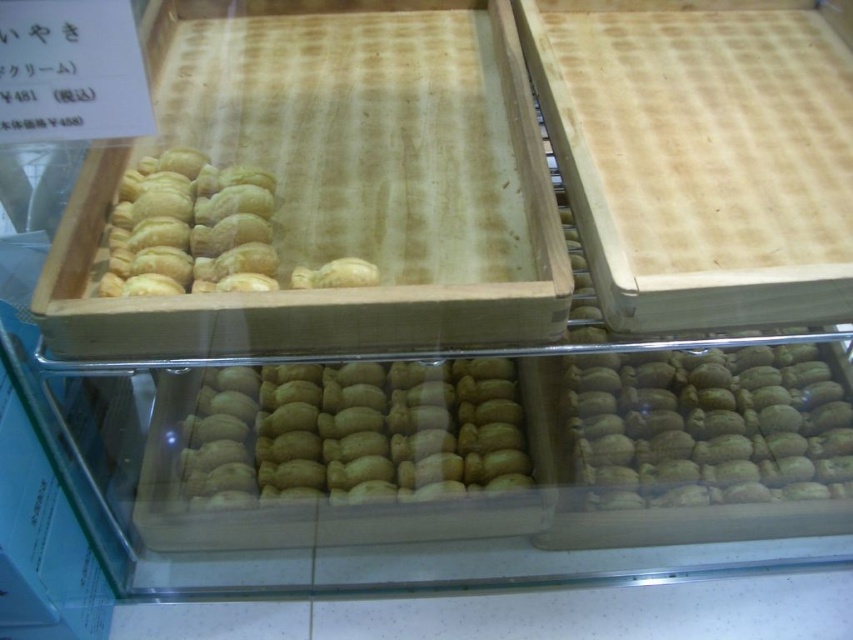
Question: Is golden matte pastry at center positioned before golden matte cream puff at center?

Choices:
 (A) no
 (B) yes

Answer: (A)

Question: Observing the image, what is the correct spatial positioning of golden matte pastry at center in reference to golden brown doughnut at upper left?

Choices:
 (A) below
 (B) above

Answer: (A)

Question: Is golden matte pastry at center bigger than golden brown doughnut at upper left?

Choices:
 (A) no
 (B) yes

Answer: (B)

Question: Which point is closer to the camera?

Choices:
 (A) golden matte pastry at center
 (B) golden brown doughnut at upper left
 (C) golden matte cream puff at center

Answer: (B)

Question: Which is farther from the golden matte cream puff at center?

Choices:
 (A) golden brown doughnut at upper left
 (B) golden matte pastry at center

Answer: (A)

Question: Based on their relative distances, which object is farther from the golden brown doughnut at upper left?

Choices:
 (A) golden matte cream puff at center
 (B) golden matte pastry at center

Answer: (A)